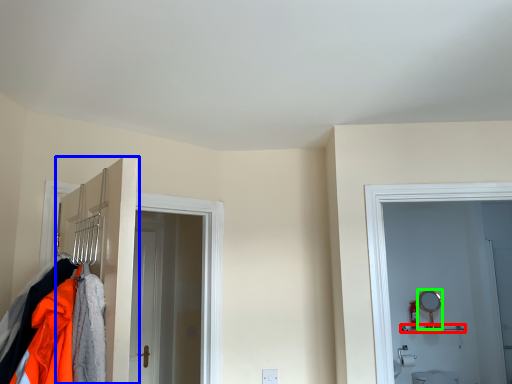
Question: Which is nearer to the shelf (highlighted by a red box)? door (highlighted by a blue box) or mirror (highlighted by a green box).

Choices:
 (A) door
 (B) mirror

Answer: (B)